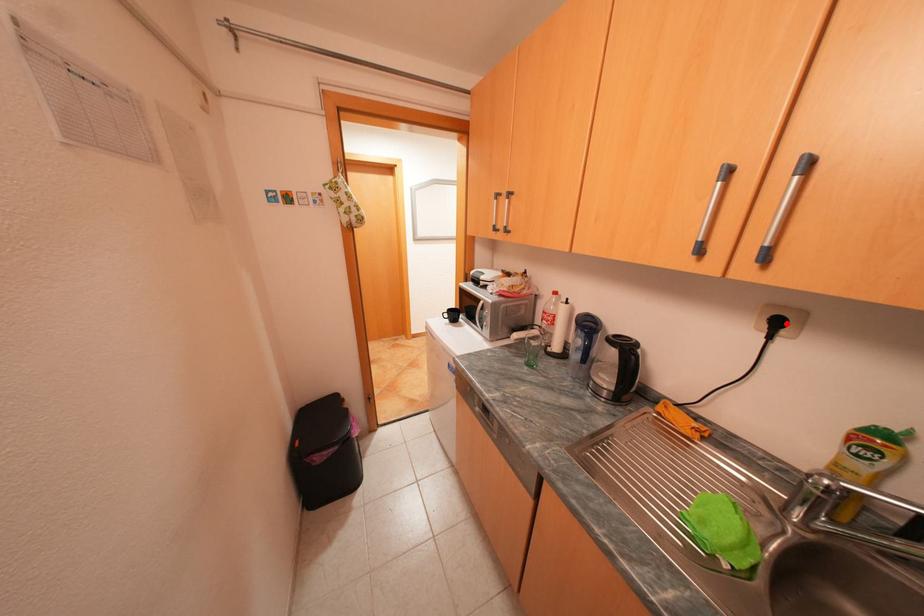
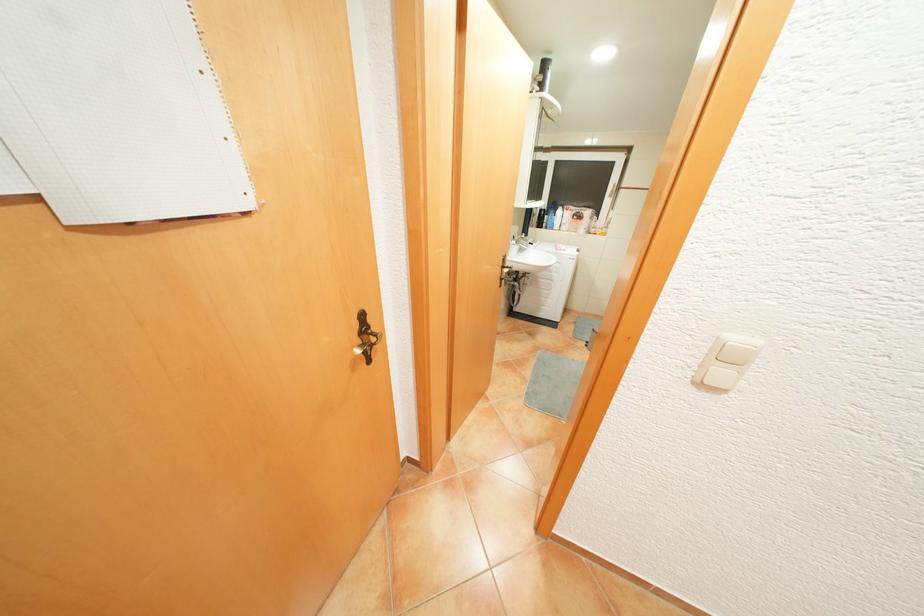
Question: I am providing you with two images of the same scene from different viewpoints. A red point is marked on the first image. At the location where the point appears in image 1, is it still visible in image 2?

Choices:
 (A) Yes
 (B) No

Answer: (B)